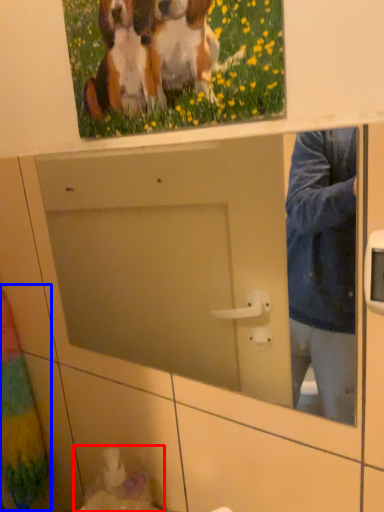
Question: Which point is further to the camera, sink (highlighted by a red box) or curtain (highlighted by a blue box)?

Choices:
 (A) sink
 (B) curtain

Answer: (B)